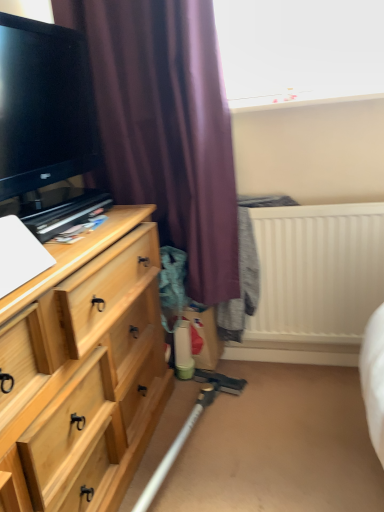
Question: From a real-world perspective, is black glossy tv at left above or below purple matte curtain at upper left?

Choices:
 (A) below
 (B) above

Answer: (B)

Question: Is point (11, 115) positioned closer to the camera than point (221, 96)?

Choices:
 (A) closer
 (B) farther

Answer: (A)

Question: Considering the real-world distances, which object is farthest from the light wood chest of drawers at left?

Choices:
 (A) black glossy tv at left
 (B) purple matte curtain at upper left
 (C) white plastic radiator at upper right

Answer: (C)

Question: Which is nearer to the purple matte curtain at upper left?

Choices:
 (A) black glossy tv at left
 (B) white plastic radiator at upper right
 (C) light wood chest of drawers at left

Answer: (A)